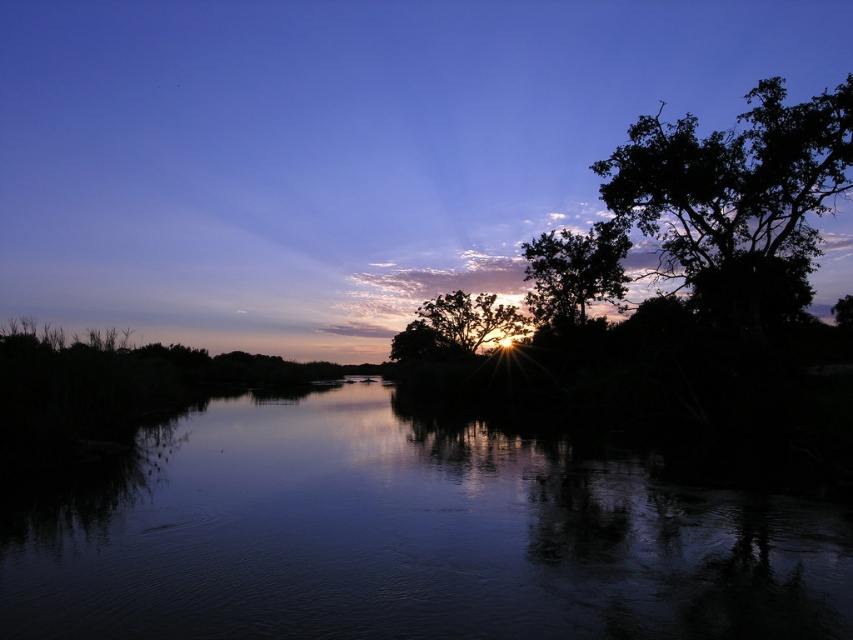
Can you confirm if smooth water at center is positioned below dark green leafy tree at upper right?

Yes.

Based on the photo, does smooth water at center have a smaller size compared to dark green leafy tree at upper right?

Yes.

Which is behind, point (624, 582) or point (659, 211)?

The point (659, 211) is behind.

What are the coordinates of `smooth water at center` in the screenshot? It's located at (408, 538).

From the picture: Between green leafy tree at center and silhouette leafy tree at center, which one is positioned lower?

silhouette leafy tree at center is below.

Is the position of green leafy tree at center less distant than that of silhouette leafy tree at center?

Yes.

Image resolution: width=853 pixels, height=640 pixels. Identify the location of green leafy tree at center. (573, 272).

Which is more to the left, dark green leafy tree at upper right or silhouette leafy tree at center?

From the viewer's perspective, silhouette leafy tree at center appears more on the left side.

Does point (679, 148) lie behind point (500, 317)?

No, it is not.

Is point (726, 220) less distant than point (421, 307)?

Yes, point (726, 220) is closer to viewer.

Where is `dark green leafy tree at upper right`? The width and height of the screenshot is (853, 640). dark green leafy tree at upper right is located at coordinates (735, 193).